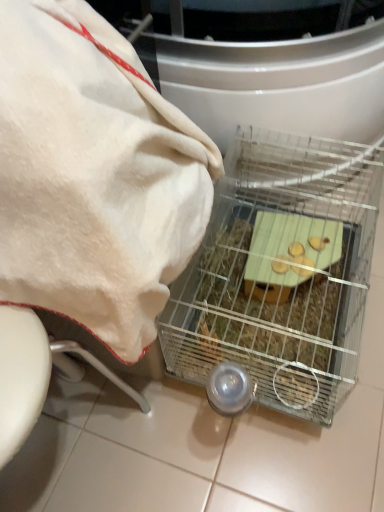
Question: From the image's perspective, is clear wire cage at center positioned above or below white soft towel at upper left?

Choices:
 (A) above
 (B) below

Answer: (B)

Question: Is clear wire cage at center in front of or behind white soft towel at upper left in the image?

Choices:
 (A) behind
 (B) front

Answer: (A)

Question: Is clear wire cage at center wider or thinner than white soft towel at upper left?

Choices:
 (A) wide
 (B) thin

Answer: (A)

Question: Considering the positions of white soft towel at upper left and clear wire cage at center in the image, is white soft towel at upper left bigger or smaller than clear wire cage at center?

Choices:
 (A) small
 (B) big

Answer: (B)

Question: Considering the positions of point (130, 249) and point (203, 328), is point (130, 249) closer or farther from the camera than point (203, 328)?

Choices:
 (A) farther
 (B) closer

Answer: (B)

Question: Is white soft towel at upper left in front of or behind clear wire cage at center in the image?

Choices:
 (A) front
 (B) behind

Answer: (A)

Question: In terms of height, does white soft towel at upper left look taller or shorter compared to clear wire cage at center?

Choices:
 (A) short
 (B) tall

Answer: (B)